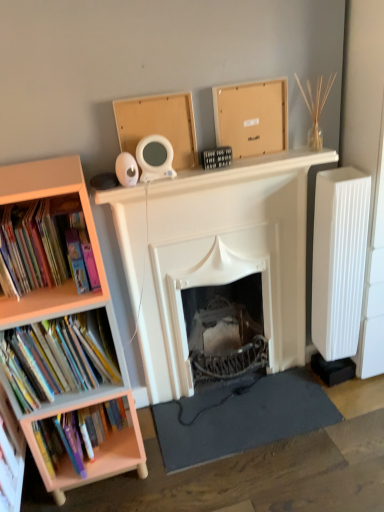
The image size is (384, 512). In order to click on vacant space in front of white matte fireplace at center in this screenshot , I will do `click(258, 473)`.